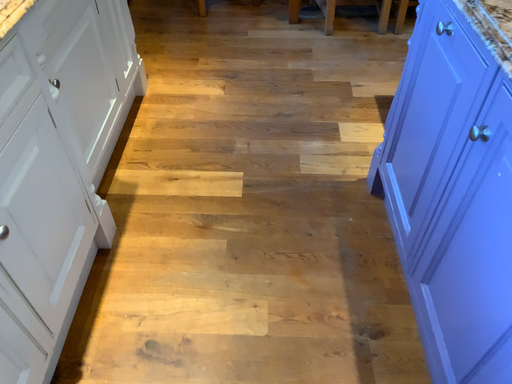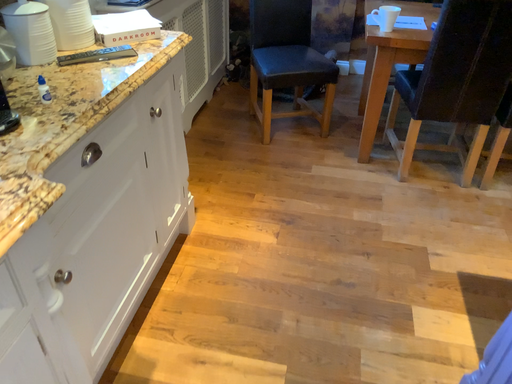
Question: Which way did the camera rotate in the video?

Choices:
 (A) rotated downward
 (B) rotated upward

Answer: (B)